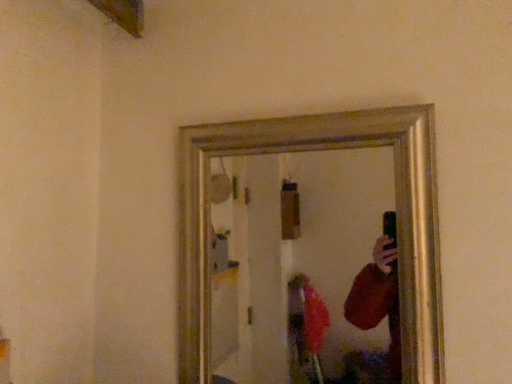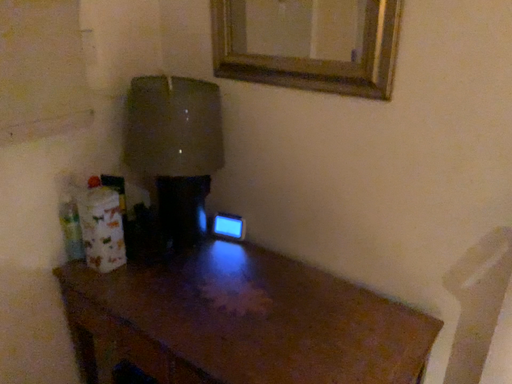
Question: How did the camera likely rotate when shooting the video?

Choices:
 (A) rotated left
 (B) rotated right

Answer: (A)